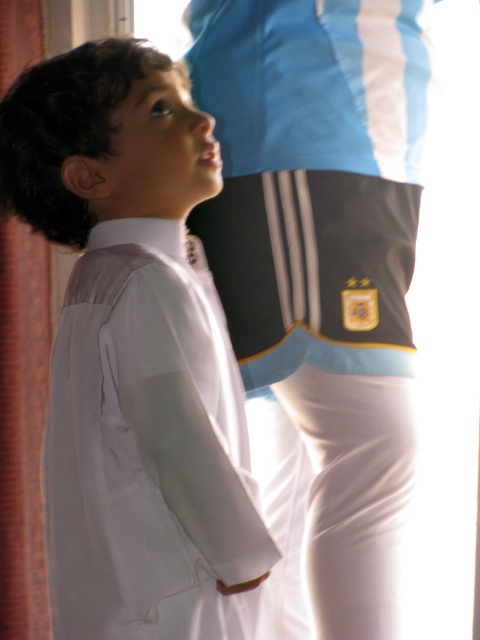
Describe the element at coordinates (134, 356) in the screenshot. This screenshot has width=480, height=640. I see `white smooth shirt at center` at that location.

Between white smooth shirt at center and brown fabric curtain at left, which one appears on the left side from the viewer's perspective?

Positioned to the left is brown fabric curtain at left.

Is point (205, 476) positioned behind point (13, 304)?

No.

The image size is (480, 640). What are the coordinates of `white smooth shirt at center` in the screenshot? It's located at (134, 356).

Is point (420, 129) closer to camera compared to point (45, 358)?

That is True.

Does blue/white striped jersey at upper center lie in front of brown fabric curtain at left?

Yes, blue/white striped jersey at upper center is closer to the viewer.

Does point (362, 211) come closer to viewer compared to point (40, 566)?

Yes, it is in front of point (40, 566).

Locate an element on the screen. The width and height of the screenshot is (480, 640). blue/white striped jersey at upper center is located at coordinates (324, 260).

Which of these two, white smooth shirt at center or blue/white striped jersey at upper center, stands shorter?

white smooth shirt at center

From the picture: Is white smooth shirt at center wider than blue/white striped jersey at upper center?

Indeed, white smooth shirt at center has a greater width compared to blue/white striped jersey at upper center.

Measure the distance between white smooth shirt at center and camera.

The distance of white smooth shirt at center from camera is 3.32 feet.

Locate an element on the screen. This screenshot has width=480, height=640. white smooth shirt at center is located at coordinates (134, 356).